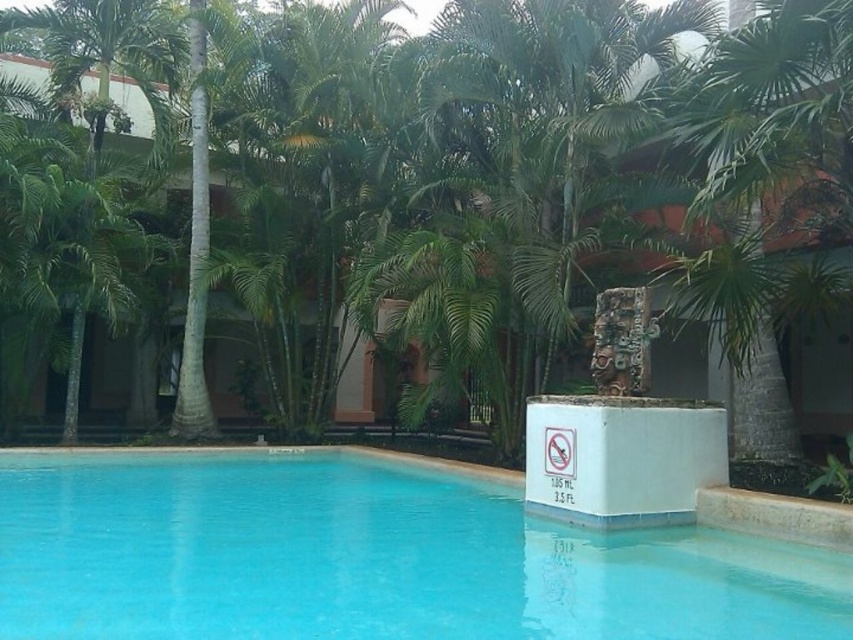
You are a lifeguard standing at the edge of the blue glossy water at center. You see a swimmer struggling near the green leafy palm tree at center. Can you reach them within 3 meters without entering the water?

The blue glossy water at center is 2.93 meters away from the green leafy palm tree at center. Since the distance is less than 3 meters, you can reach the swimmer without entering the water.

You are planning to place a small bench between the blue glossy water at center and the green leafy palm tree at center. Based on their widths, which object should the bench be closer to?

The bench should be placed closer to the green leafy palm tree at center because the blue glossy water at center is wider than the palm tree.

You are standing at the point marked by coordinates (x=369, y=557). Based on the scene description, what object are you most likely standing on?

The blue glossy water at center is represented by point (x=369, y=557), so you are most likely standing on the blue glossy water at center.